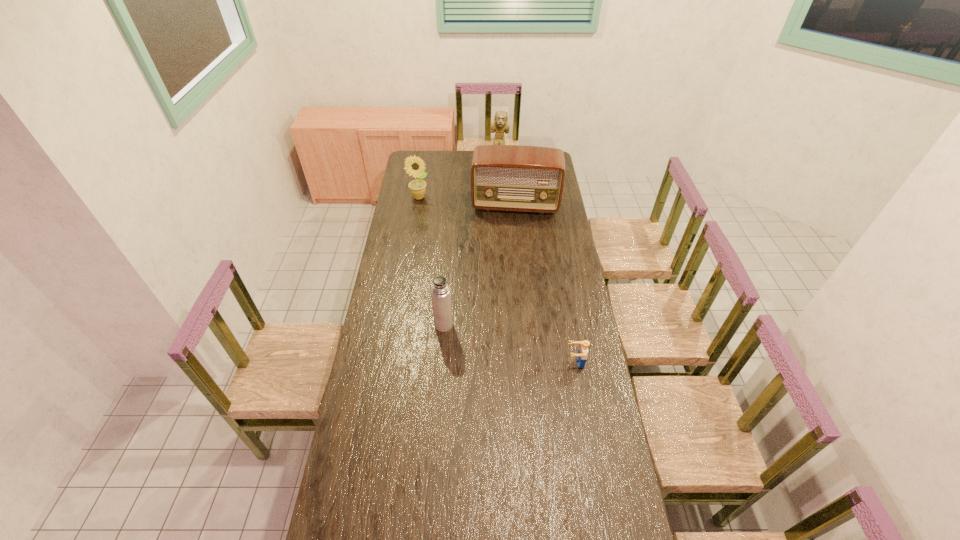
Find the location of `vacant space on the desktop that is between the thermos bottle and the nearest object and is positioned on the face of the leftmost object`. vacant space on the desktop that is between the thermos bottle and the nearest object and is positioned on the face of the leftmost object is located at coordinates point(523,347).

Find the location of a particular element. vacant space on the desktop that is between the thermos bottle and the nearest object and is positioned on the front-facing side of the radio receiver is located at coordinates (510, 343).

Where is `free space on the desktop that is between the thermos bottle and the nearest object and is positioned on the front-facing side of the farthest object`? This screenshot has width=960, height=540. free space on the desktop that is between the thermos bottle and the nearest object and is positioned on the front-facing side of the farthest object is located at coordinates (499, 341).